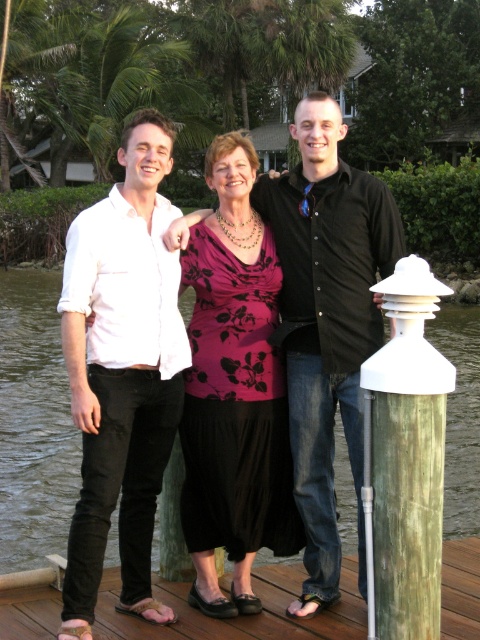
You are a photographer trying to capture the scene from the dock. You notice the white cotton shirt at left and the transparent water at dock center. Which object would appear shorter in your photo?

The white cotton shirt at left would appear shorter in the photo because it has a lesser height compared to the transparent water at dock center.

You are standing at the point labeled as point (159, 355). You want to walk towards the nearest palm tree located 10 meters away from you. However, there is an obstacle 3 meters away from your current position. Can you safely walk around the obstacle and reach the palm tree without going beyond the dock?

The distance between point (159, 355) and the viewer is 4.71 meters. Since the obstacle is only 3 meters away, you have enough space to navigate around it and continue towards the palm tree 10 meters away. However, ensure the dock extends far enough to accommodate the 10 meter journey.